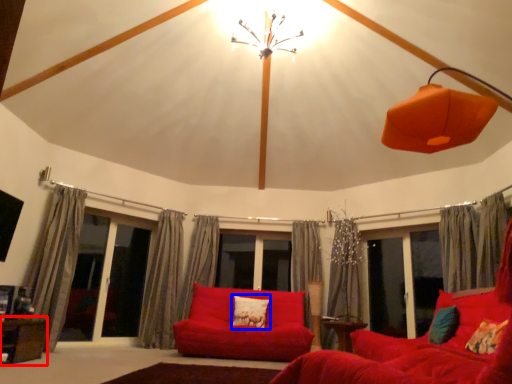
Question: Which point is closer to the camera, table (highlighted by a red box) or pillow (highlighted by a blue box)?

Choices:
 (A) table
 (B) pillow

Answer: (A)